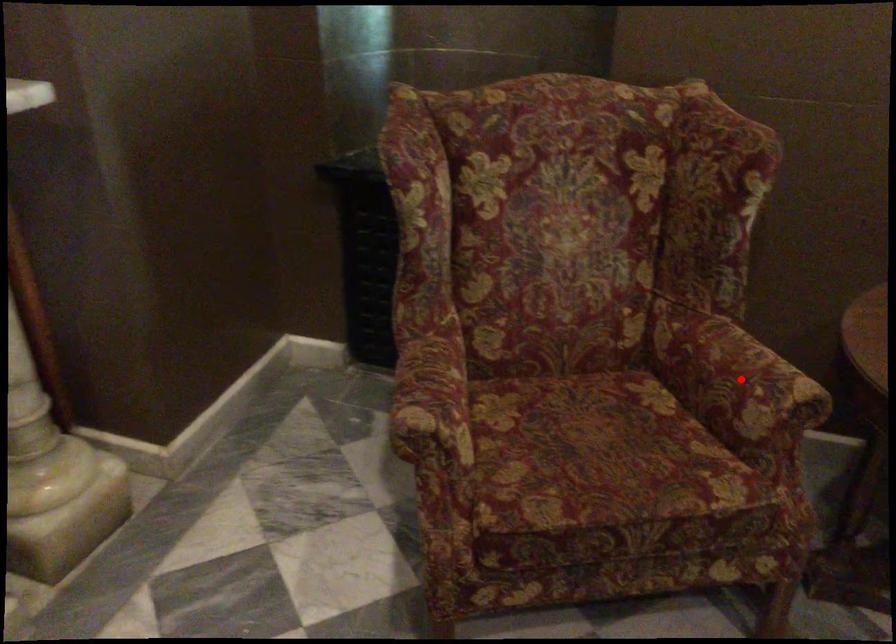
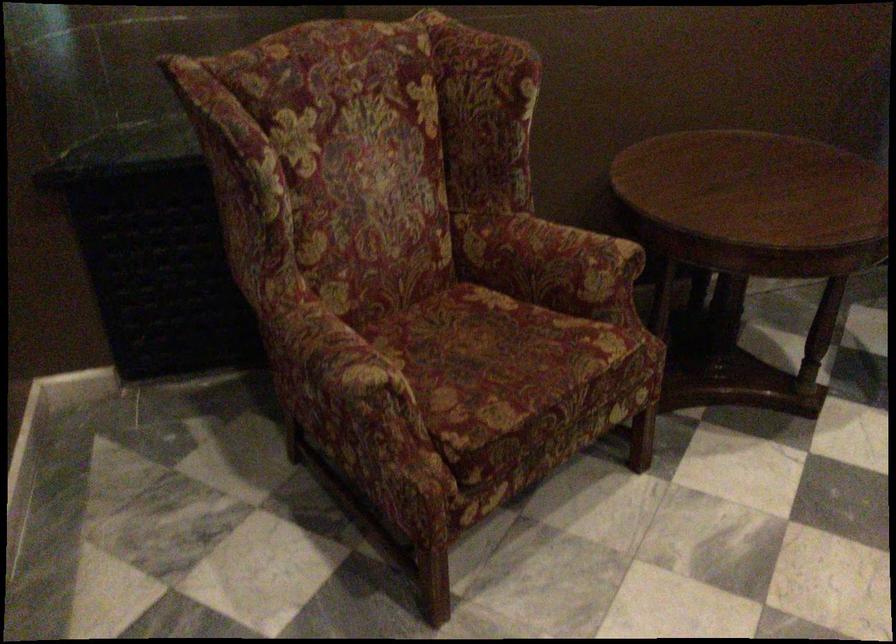
In the second image, find the point that corresponds to the highlighted location in the first image.

(572, 256)